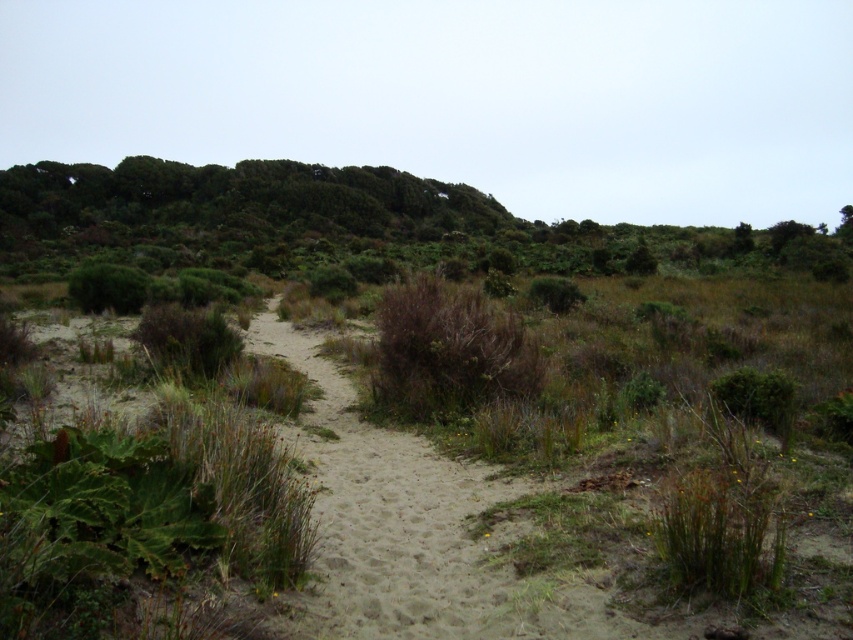
Is point (515, 352) farther from viewer compared to point (732, 380)?

Yes.

Can you confirm if brown fuzzy bush at center is positioned above green leafy bush at lower right?

Yes, brown fuzzy bush at center is above green leafy bush at lower right.

At what (x,y) coordinates should I click in order to perform the action: click on brown fuzzy bush at center. Please return your answer as a coordinate pair (x, y). The image size is (853, 640). Looking at the image, I should click on (448, 349).

Based on the photo, can you confirm if brown dry bush at lower left is smaller than green leafy bush at lower right?

Yes, brown dry bush at lower left is smaller than green leafy bush at lower right.

Is point (194, 328) closer to camera compared to point (724, 390)?

No, it is not.

Find the location of a particular element. brown dry bush at lower left is located at coordinates (189, 339).

Identify the location of brown fuzzy bush at center. Image resolution: width=853 pixels, height=640 pixels. (448, 349).

Which of these two, brown fuzzy bush at center or green fuzzy bush at lower left, stands taller?

green fuzzy bush at lower left is taller.

Does point (447, 404) lie in front of point (141, 296)?

Yes.

Locate an element on the screen. The image size is (853, 640). brown fuzzy bush at center is located at coordinates (448, 349).